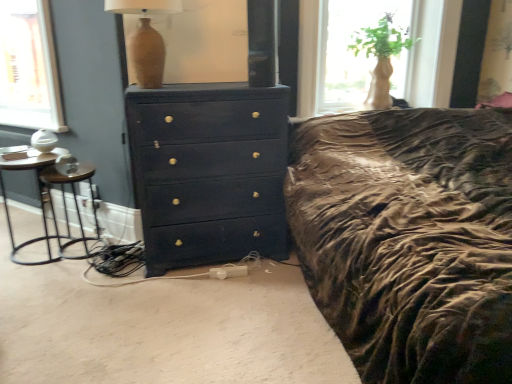
Question: In the image, is metallic silver side table at left on the left side or the right side of black metal bar stool at left?

Choices:
 (A) right
 (B) left

Answer: (B)

Question: Choose the correct answer: Is metallic silver side table at left inside black metal bar stool at left or outside it?

Choices:
 (A) inside
 (B) outside

Answer: (A)

Question: Estimate the real-world distances between objects in this image. Which object is farther from the matte beige vase at upper center?

Choices:
 (A) translucent glass vase at upper right
 (B) matte dark blue dresser at center
 (C) metallic silver side table at left
 (D) black metal bar stool at left

Answer: (A)

Question: Which object is positioned closest to the metallic silver side table at left?

Choices:
 (A) translucent glass vase at upper right
 (B) matte dark blue dresser at center
 (C) black metal bar stool at left
 (D) matte beige vase at upper center

Answer: (C)